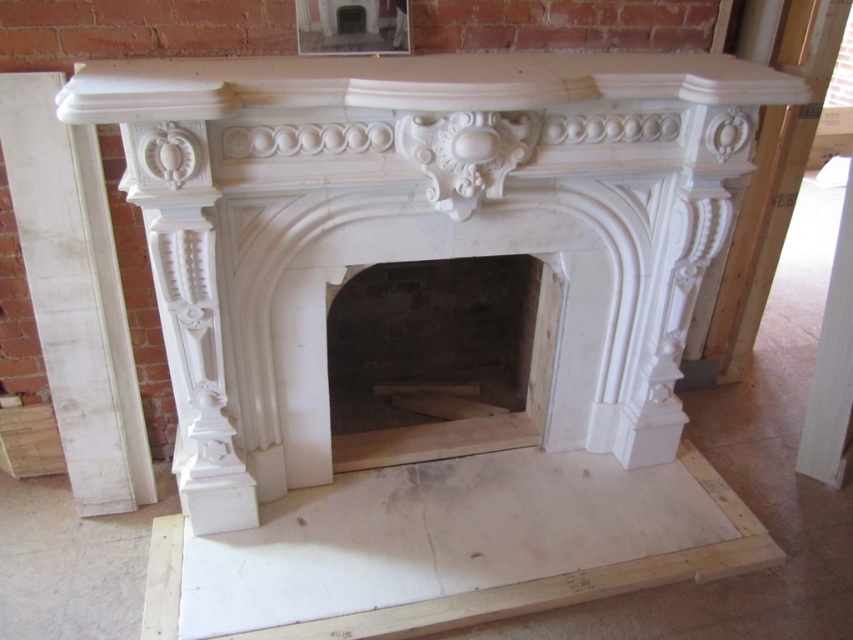
You are an interior designer working on a construction site. You need to place a new sofa in the living room. The sofa is 3 feet wide. There is a space between the white marble fireplace at center and the white marble fireplace at right. Can the sofa fit in that space?

The space between the white marble fireplace at center and the white marble fireplace at right is 31.84 inches. Since the sofa is 3 feet wide, which is 36 inches, the sofa cannot fit in the space between them because it is wider than the available space.

You are an architect inspecting the construction site. You need to place a new wooden beam exactly at point 0.5, 0.1. The white marble fireplace at left is already installed. Is the new beam going to be placed to the left or right of the fireplace?

The white marble fireplace at left is located at point (74, 296). The new beam is at point (84, 320). Since 0.5 is greater than 0.463 on the x coordinate, the new beam will be placed to the right of the white marble fireplace at left.